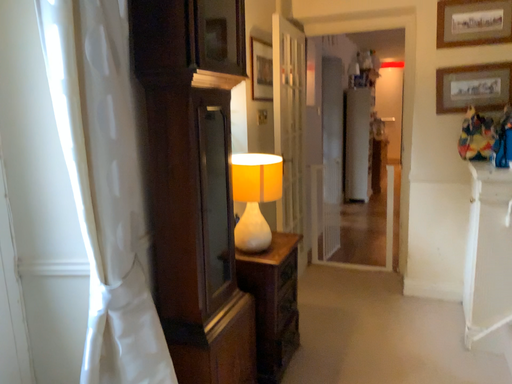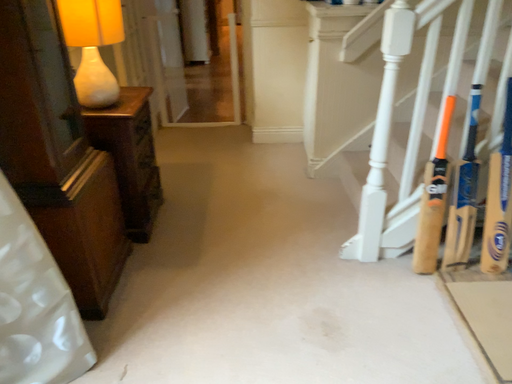
Question: Which way did the camera rotate in the video?

Choices:
 (A) rotated left
 (B) rotated right

Answer: (B)